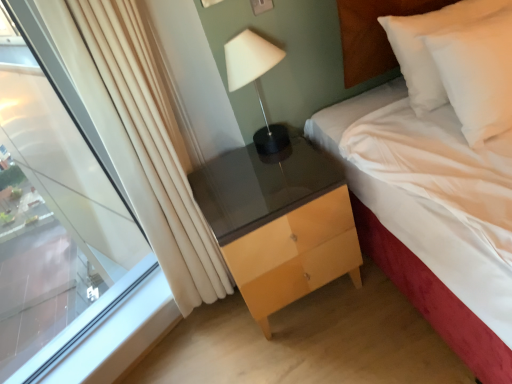
Locate an element on the screen. The width and height of the screenshot is (512, 384). vacant space that is to the left of matte black lamp at upper center is located at coordinates coord(228,168).